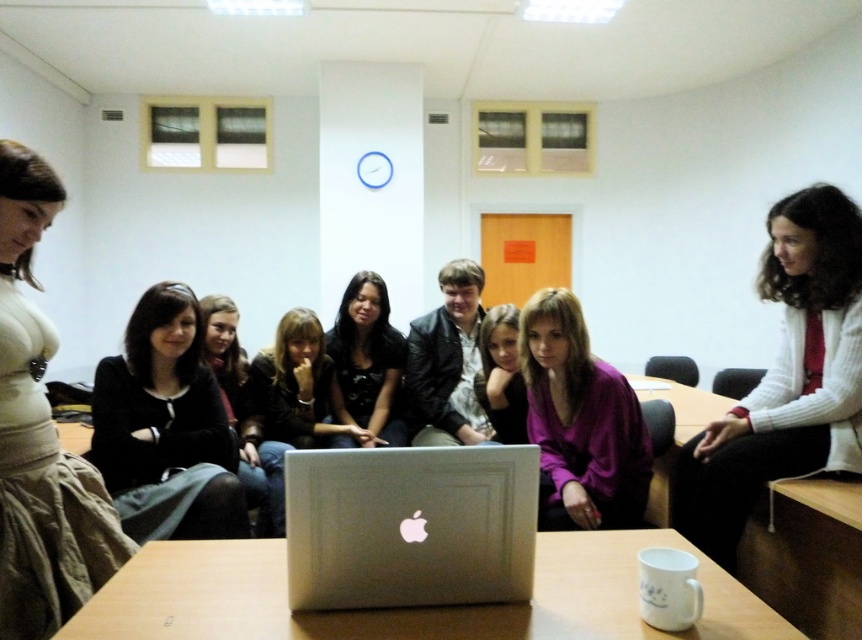
Question: Can you confirm if matte black shirt at center is smaller than matte black jacket at center?

Choices:
 (A) yes
 (B) no

Answer: (A)

Question: Based on their relative distances, which object is farther from the white knit cardigan at center?

Choices:
 (A) black matte shirt at center
 (B) black matte skirt at lower left
 (C) matte black shirt at center
 (D) matte black hair at center

Answer: (B)

Question: Can you confirm if black matte shirt at center is bigger than matte black shirt at center?

Choices:
 (A) no
 (B) yes

Answer: (B)

Question: Which is nearer to the white knit cardigan at center?

Choices:
 (A) silver metallic laptop at center
 (B) black matte shirt at center
 (C) matte black shirt at center
 (D) black matte skirt at lower left

Answer: (A)

Question: Which of the following is the closest to the observer?

Choices:
 (A) wooden table at center
 (B) purple matte sweater at center
 (C) white knit cardigan at center
 (D) black matte shirt at center

Answer: (A)

Question: Does white textured sweater at left appear on the right side of matte black hair at center?

Choices:
 (A) no
 (B) yes

Answer: (A)